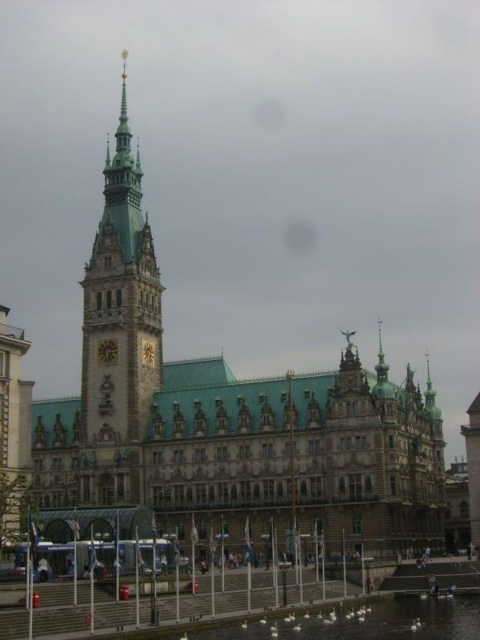
Question: Observing the image, what is the correct spatial positioning of green metallic building at center in reference to stone clock tower at center-left?

Choices:
 (A) below
 (B) above

Answer: (A)

Question: Which of the following is the farthest from the observer?

Choices:
 (A) click(137, 426)
 (B) click(326, 480)

Answer: (A)

Question: Is green metallic building at center bigger than stone clock tower at center-left?

Choices:
 (A) no
 (B) yes

Answer: (B)

Question: Does green metallic building at center appear on the right side of stone clock tower at center-left?

Choices:
 (A) no
 (B) yes

Answer: (B)

Question: Among these points, which one is nearest to the camera?

Choices:
 (A) (96, 360)
 (B) (245, 499)

Answer: (B)

Question: Which point is farther from the camera taking this photo?

Choices:
 (A) (265, 396)
 (B) (136, 186)

Answer: (B)